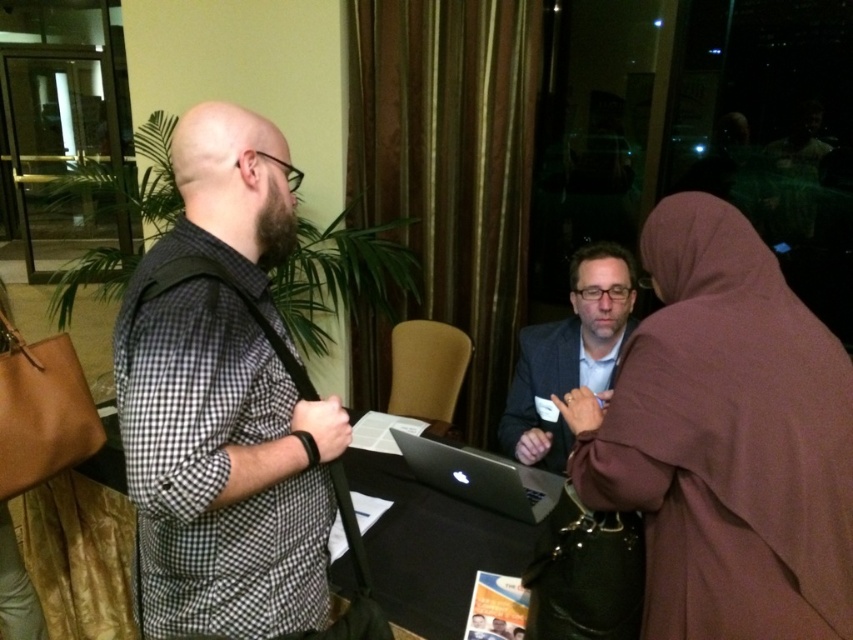
You are organizing a photo shoot and need to position the brown fabric robe at right and the matte black suit at center in a specific layout. According to the scene description, which object should be placed to the right of the other?

The brown fabric robe at right should be placed to the right of the matte black suit at center as per the scene description.

Where is the brown fabric robe at right located in the image?

The brown fabric robe at right is located at point (726, 440) in the image.

You are a security guard in the conference room. You notice two people in the scene. One is wearing a brown fabric robe at right and the other is wearing a matte black suit at center. Which person should you approach first based on their height?

The brown fabric robe at right is much taller than the matte black suit at center, so you should approach the person wearing the brown fabric robe at right first because they are taller.